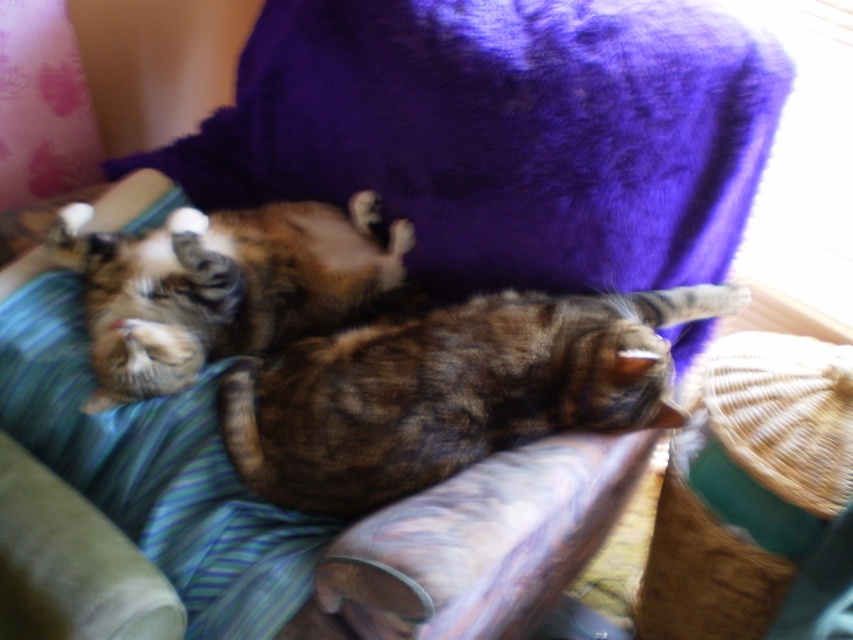
Question: Does brown fur cat at center come in front of tabby fur cat at center?

Choices:
 (A) no
 (B) yes

Answer: (B)

Question: Observing the image, what is the correct spatial positioning of brown fur cat at center in reference to tabby fur cat at center?

Choices:
 (A) above
 (B) below

Answer: (B)

Question: Which point is farther to the camera?

Choices:
 (A) brown fur cat at center
 (B) tabby fur cat at center

Answer: (B)

Question: From the image, what is the correct spatial relationship of brown fur cat at center in relation to tabby fur cat at center?

Choices:
 (A) above
 (B) below

Answer: (B)